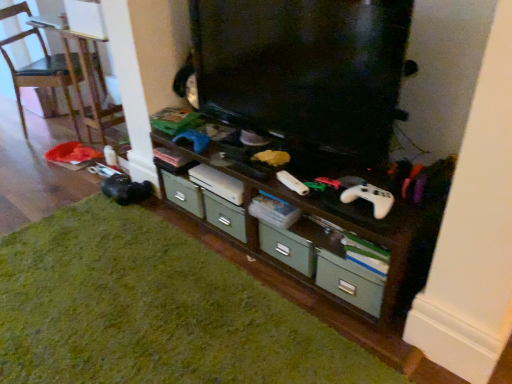
The height and width of the screenshot is (384, 512). I want to click on free spot in front of green matte drawer at lower center, so click(359, 344).